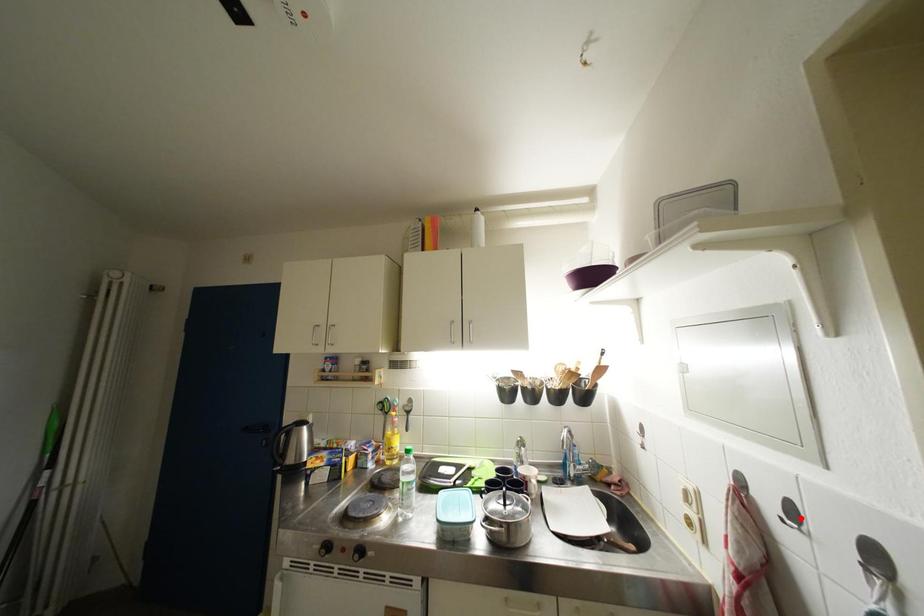
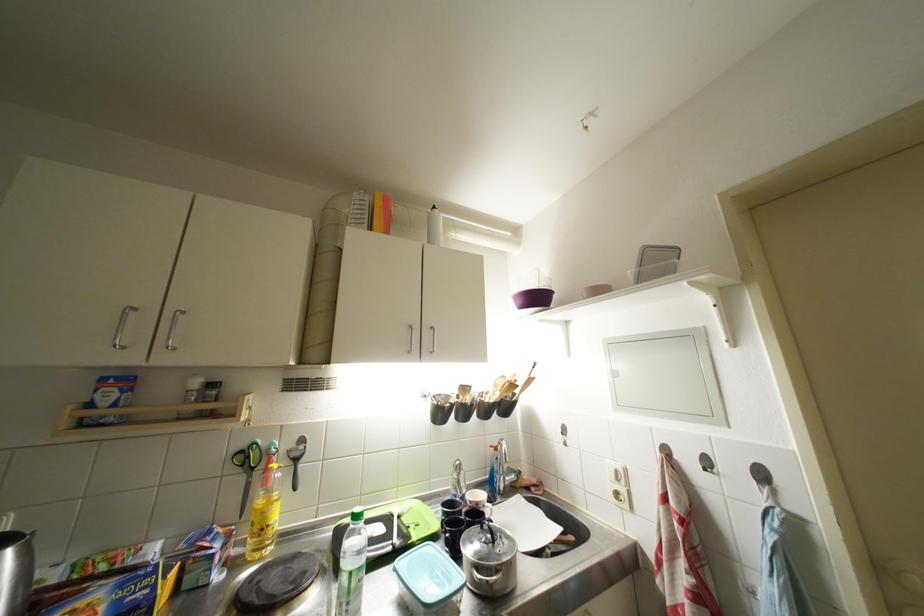
Question: I am providing you with two images of the same scene from different viewpoints. A red point is marked on the first image. At the location where the point appears in image 1, is it still visible in image 2?

Choices:
 (A) Yes
 (B) No

Answer: (A)